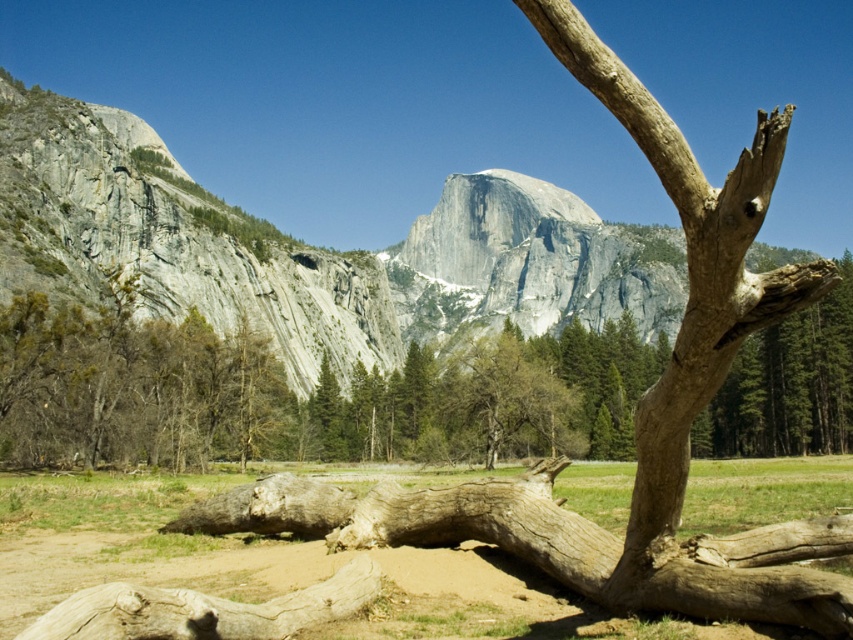
Question: Does brown dirt field at lower center have a greater width compared to brown rough log at lower left?

Choices:
 (A) no
 (B) yes

Answer: (B)

Question: Which object is farther from the camera taking this photo?

Choices:
 (A) brown rough log at lower left
 (B) brown dirt field at lower center

Answer: (B)

Question: Which point appears farthest from the camera in this image?

Choices:
 (A) click(753, 598)
 (B) click(322, 589)

Answer: (B)

Question: Does brown dirt field at lower center appear over brown rough log at lower left?

Choices:
 (A) yes
 (B) no

Answer: (A)

Question: Does brown dirt field at lower center have a larger size compared to brown rough log at lower left?

Choices:
 (A) no
 (B) yes

Answer: (B)